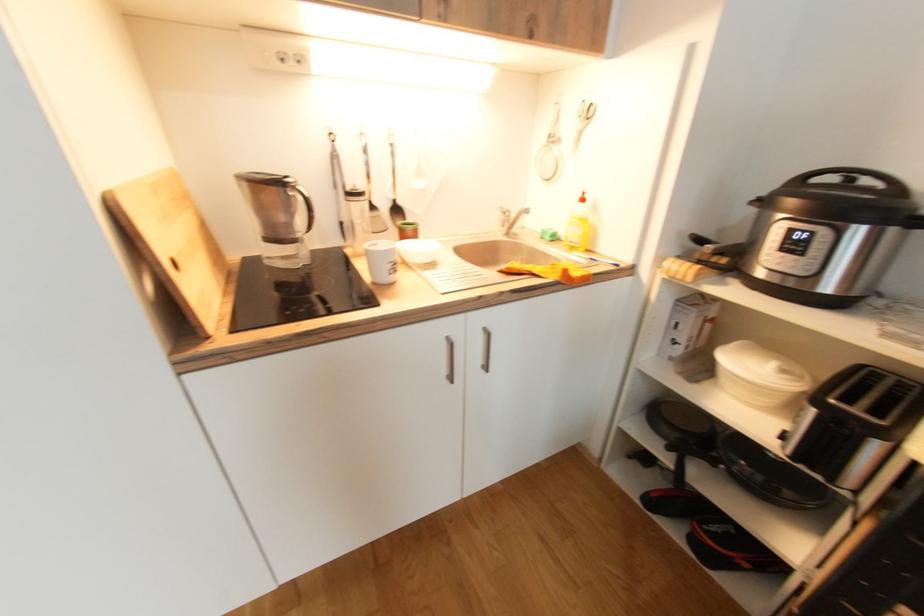
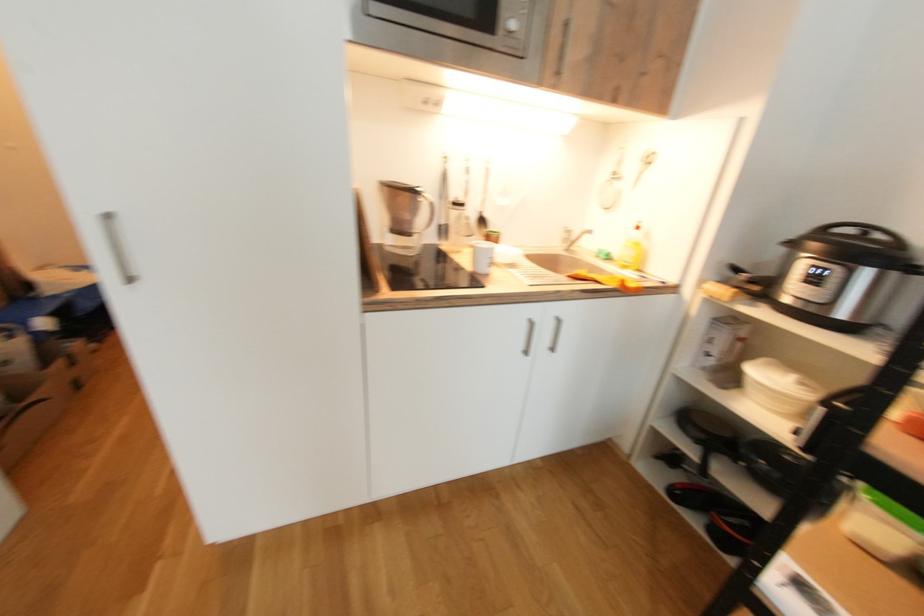
The images are taken continuously from a first-person perspective. In which direction are you moving?

The cameraman walked toward left, backward.